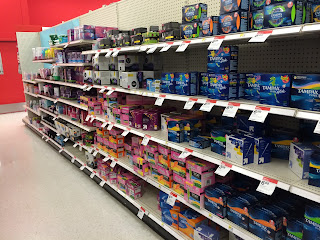
Identify the location of clear windows. The width and height of the screenshot is (320, 240). (1, 69), (19, 68).